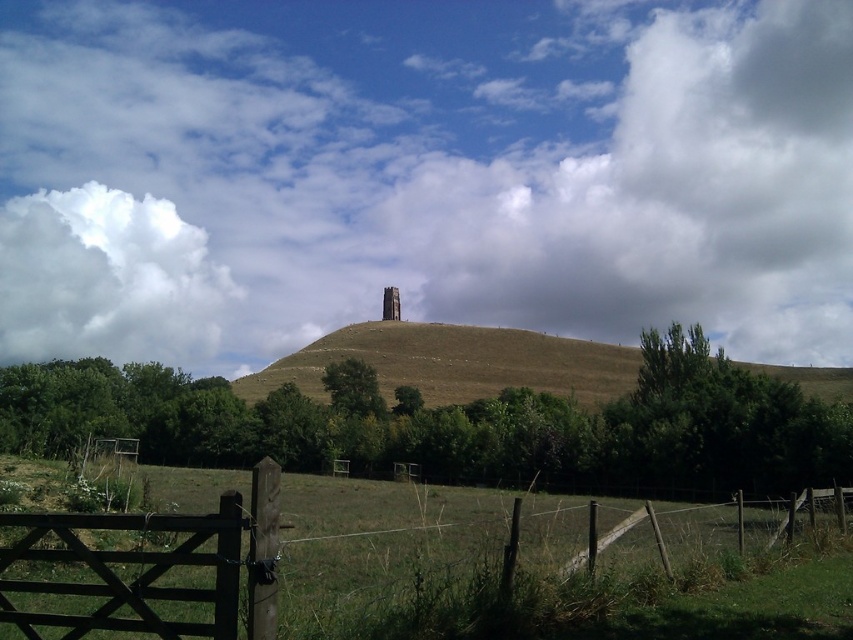
Can you confirm if white fluffy cloud at upper center is shorter than white fluffy cloud at upper left?

In fact, white fluffy cloud at upper center may be taller than white fluffy cloud at upper left.

Does point (434, 308) come in front of point (183, 323)?

Yes, point (434, 308) is in front of point (183, 323).

Locate an element on the screen. The width and height of the screenshot is (853, 640). white fluffy cloud at upper center is located at coordinates (422, 172).

Where is `white fluffy cloud at upper center`? This screenshot has width=853, height=640. white fluffy cloud at upper center is located at coordinates (422, 172).

Who is positioned more to the right, wooden gate at lower left or stone tower at center?

wooden gate at lower left

Between wooden gate at lower left and stone tower at center, which one appears on the left side from the viewer's perspective?

stone tower at center is more to the left.

Image resolution: width=853 pixels, height=640 pixels. What are the coordinates of `wooden gate at lower left` in the screenshot? It's located at (132, 561).

Can you confirm if white fluffy cloud at upper center is shorter than green grassy field at lower center?

In fact, white fluffy cloud at upper center may be taller than green grassy field at lower center.

Is point (267, 188) positioned behind point (514, 618)?

Yes, point (267, 188) is behind point (514, 618).

Find the location of a particular element. The height and width of the screenshot is (640, 853). white fluffy cloud at upper center is located at coordinates (422, 172).